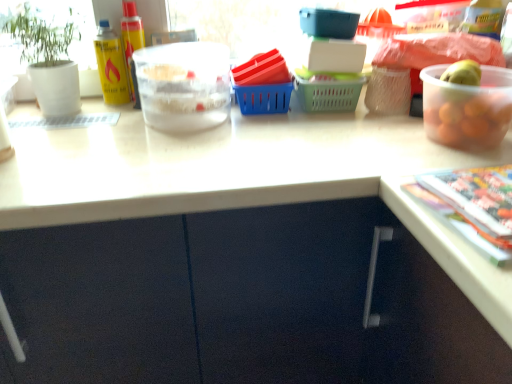
This screenshot has width=512, height=384. Identify the location of free space between green matte plant pot at left and transparent plastic bowl at upper right, placed as the 2th bowl when sorted from left to right. pos(256,128).